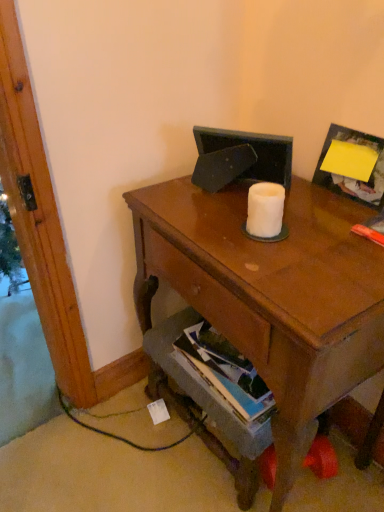
Identify the location of free point to the right of white matte toilet paper at center. The height and width of the screenshot is (512, 384). (326, 229).